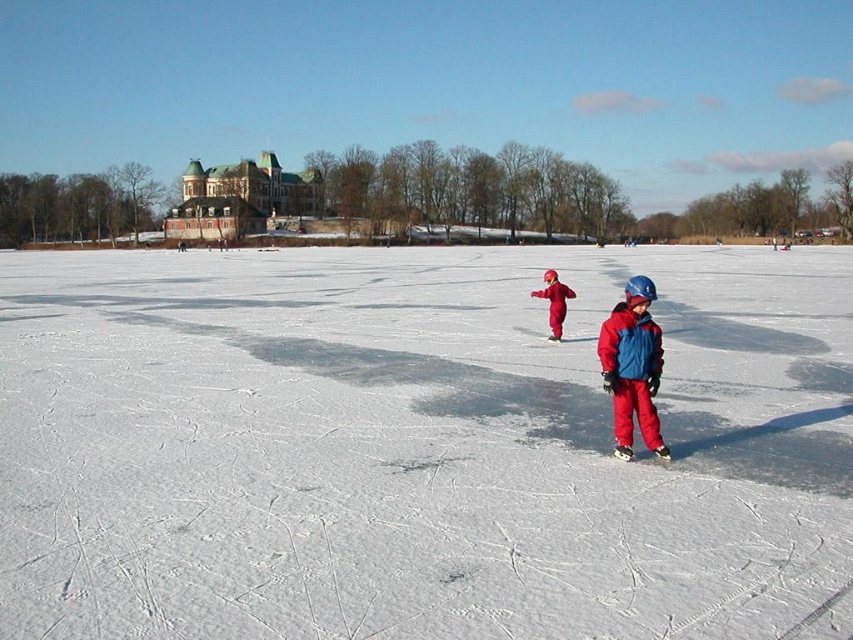
Question: Which point is farther to the camera?

Choices:
 (A) matte blue helmet at center
 (B) matte red snowsuit at center

Answer: (B)

Question: Which object is farther from the camera taking this photo?

Choices:
 (A) matte red snowsuit at center
 (B) matte blue helmet at center

Answer: (A)

Question: Which point is closer to the camera?

Choices:
 (A) red fleece jacket at lower right
 (B) matte red snowsuit at center
 (C) matte blue helmet at center
 (D) white smooth ice at center

Answer: (D)

Question: Is white smooth ice at center bigger than red fleece jacket at lower right?

Choices:
 (A) no
 (B) yes

Answer: (B)

Question: Does matte blue helmet at center come in front of red fleece jacket at lower right?

Choices:
 (A) no
 (B) yes

Answer: (B)

Question: In this image, where is white smooth ice at center located relative to matte red snowsuit at center?

Choices:
 (A) right
 (B) left

Answer: (B)